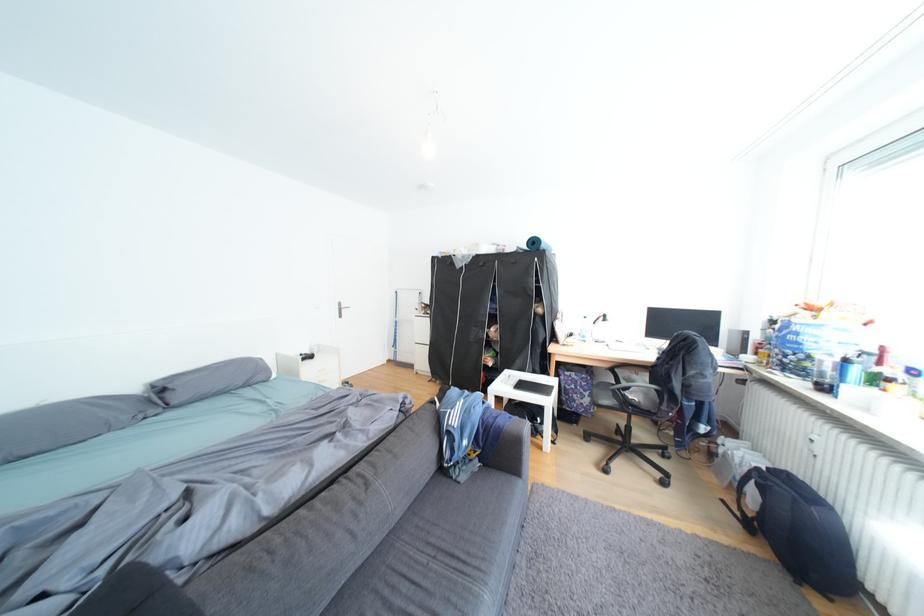
The height and width of the screenshot is (616, 924). I want to click on grey sofa sitting surface, so click(x=444, y=551).